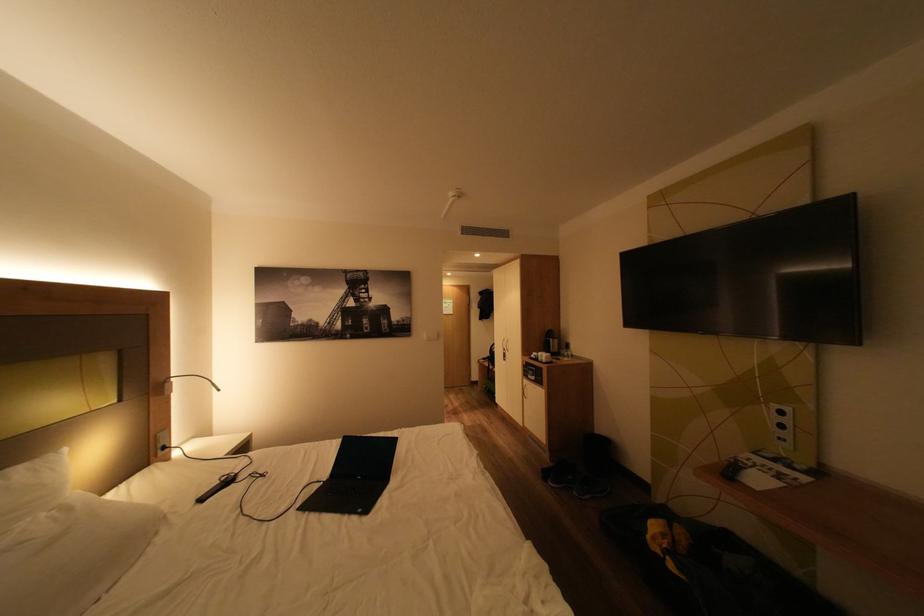
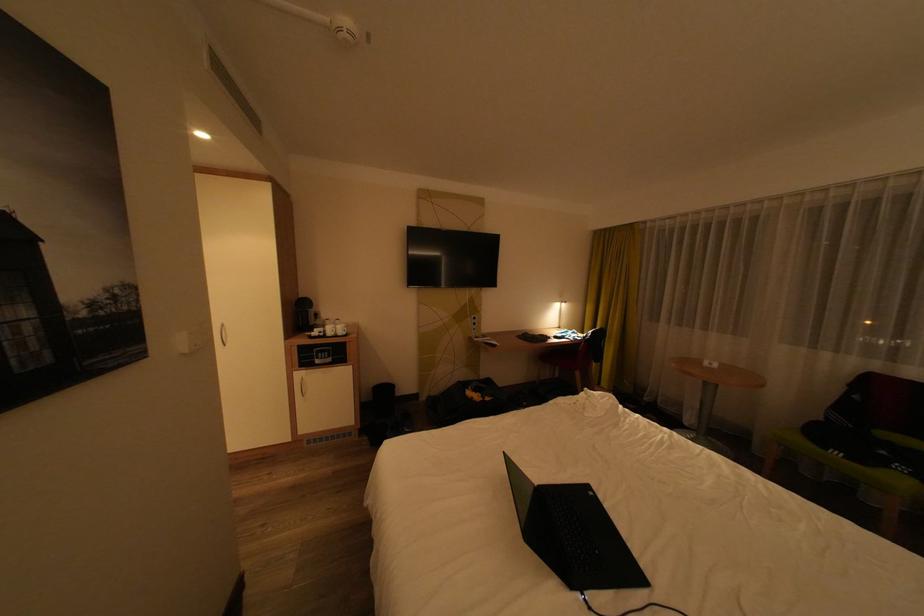
In the second image, find the point that corresponds to (x=544, y=355) in the first image.

(331, 333)